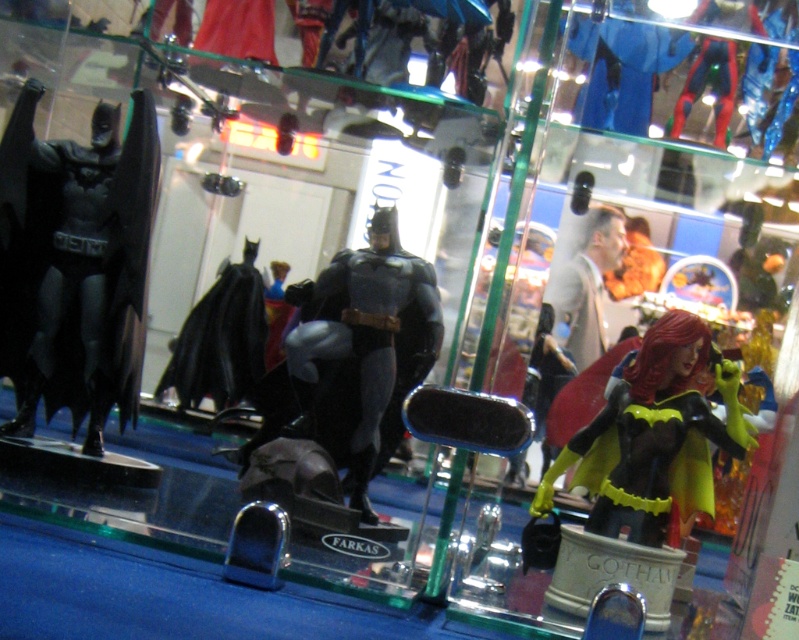
Is yellow matte batgirl figure at right smaller than matte black cape at center?

No.

Between yellow matte batgirl figure at right and matte black cape at center, which one appears on the left side from the viewer's perspective?

matte black cape at center is more to the left.

Who is more distant from viewer, (724, 374) or (231, 403)?

Point (231, 403)

The image size is (799, 640). I want to click on yellow matte batgirl figure at right, so click(x=654, y=436).

Is matte black batman figure at center above matte black cape at center?

Incorrect, matte black batman figure at center is not positioned above matte black cape at center.

The image size is (799, 640). I want to click on matte black batman figure at center, so click(368, 340).

This screenshot has width=799, height=640. I want to click on matte black batman figure at center, so click(x=368, y=340).

What do you see at coordinates (74, 262) in the screenshot?
I see `matte black batman figure at left` at bounding box center [74, 262].

At what (x,y) coordinates should I click in order to perform the action: click on matte black batman figure at left. Please return your answer as a coordinate pair (x, y). Image resolution: width=799 pixels, height=640 pixels. Looking at the image, I should click on (74, 262).